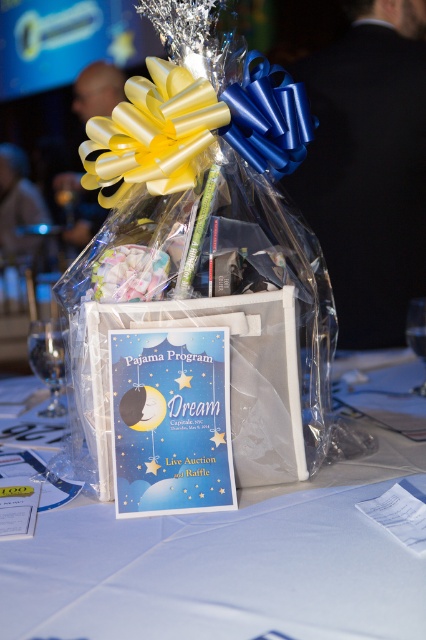
You are a volunteer at the event and need to locate the blue satin ribbon at upper center. According to the coordinates provided, where exactly should you look on the gift basket?

The blue satin ribbon at upper center is located at point (267,118).

Looking at this image, you are a volunteer at the event and need to place a 50 cm wide decorative ribbon horizontally between the two points marked as point [302,108]. Will the ribbon fit without overlapping either point?

The two points are 55.31 centimeters apart, so a 50 cm wide ribbon will fit between them without overlapping either point since 50 cm is less than 55.31 cm.